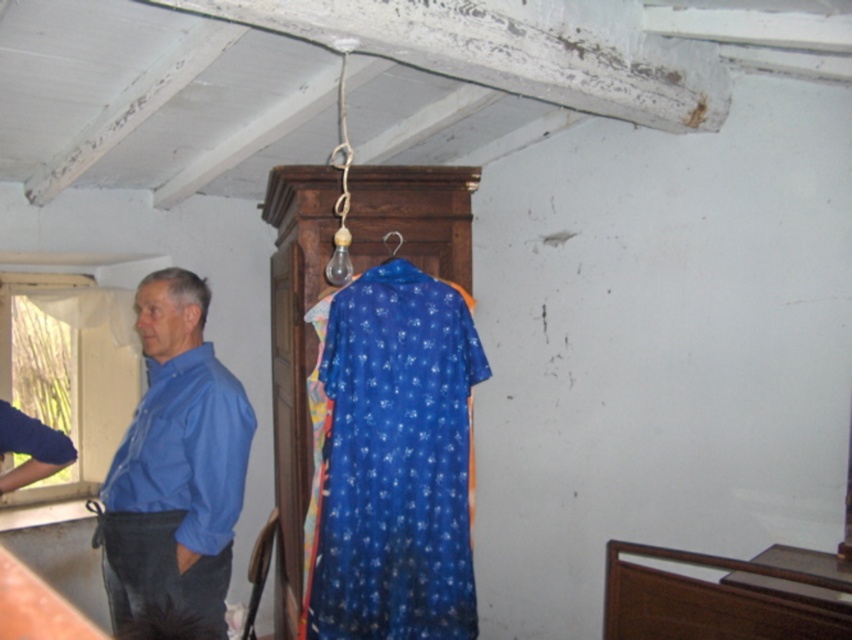
Question: Does blue cotton shirt at center appear under metallic hook at center?

Choices:
 (A) yes
 (B) no

Answer: (A)

Question: Can you confirm if blue cotton shirt at center is wider than metallic hook at center?

Choices:
 (A) yes
 (B) no

Answer: (A)

Question: Which object is farther from the camera taking this photo?

Choices:
 (A) matte blue shirt at left
 (B) metallic hook at center
 (C) blue cotton shirt at center

Answer: (B)

Question: Which object appears closest to the camera in this image?

Choices:
 (A) matte blue shirt at left
 (B) metallic hook at center
 (C) blue cotton shirt at center

Answer: (A)

Question: Where is blue cotton shirt at center located in relation to matte blue shirt at left in the image?

Choices:
 (A) above
 (B) below

Answer: (B)

Question: Based on their relative distances, which object is farther from the matte blue shirt at left?

Choices:
 (A) metallic hook at center
 (B) blue cotton shirt at center

Answer: (A)